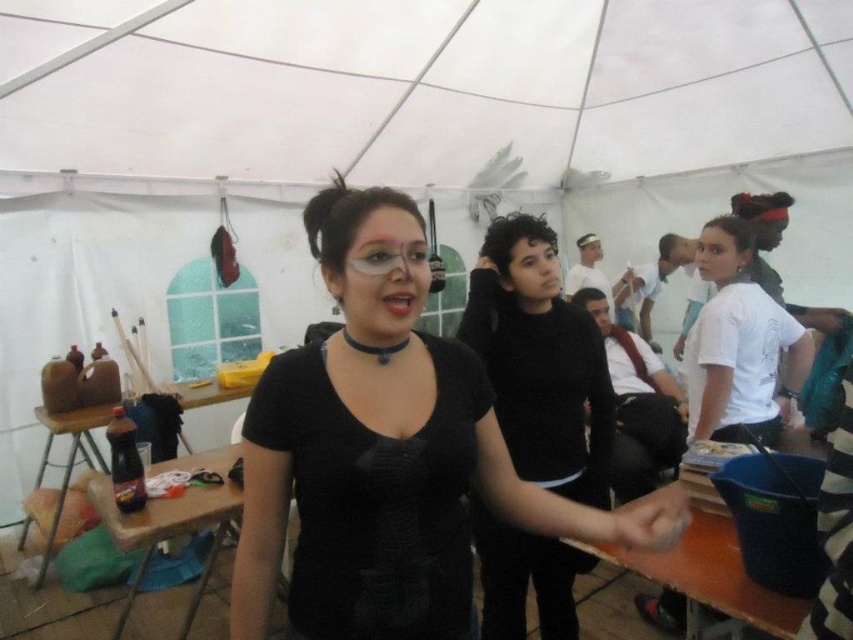
Question: Estimate the real-world distances between objects in this image. Which object is closer to the brown plastic table at lower left?

Choices:
 (A) black matte sweater at center
 (B) matte black shirt at center

Answer: (A)

Question: Does white matte shirt at upper right have a greater width compared to brown wooden table at lower right?

Choices:
 (A) no
 (B) yes

Answer: (B)

Question: Which of these objects is positioned closest to the brown plastic table at lower left?

Choices:
 (A) white matte shirt at upper right
 (B) matte black shirt at center

Answer: (B)

Question: Which of the following is the closest to the observer?

Choices:
 (A) black mesh dress at center
 (B) matte black shirt at center
 (C) black matte sweater at center

Answer: (A)

Question: Does matte black shirt at center appear over brown wooden table at lower right?

Choices:
 (A) no
 (B) yes

Answer: (B)

Question: Does black matte sweater at center appear on the left side of brown wooden table at lower right?

Choices:
 (A) no
 (B) yes

Answer: (B)